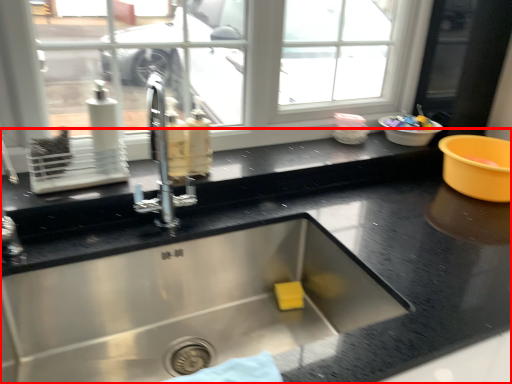
Question: From the image's perspective, what is the correct spatial relationship of countertop (annotated by the red box) in relation to basin?

Choices:
 (A) below
 (B) above

Answer: (A)